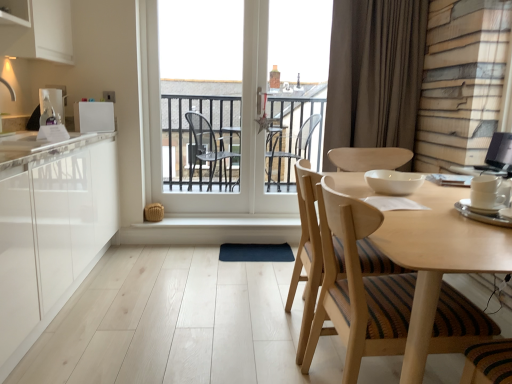
Question: Is point (337, 79) positioned closer to the camera than point (22, 170)?

Choices:
 (A) closer
 (B) farther

Answer: (B)

Question: From the image's perspective, is brown fabric curtain at upper right above or below white glossy countertop at left?

Choices:
 (A) above
 (B) below

Answer: (A)

Question: Considering the real-world distances, which object is farthest from the white ceramic cup at right, the 4th appliance positioned from the left?

Choices:
 (A) matte white soap dispenser at left, the 5th appliance from the front
 (B) white glass door at center
 (C) white glossy countertop at left
 (D) wooden chair with striped cushion at center
 (E) light wood round table at center

Answer: (A)

Question: Estimate the real-world distances between objects in this image. Which object is closer to the white glossy countertop at left?

Choices:
 (A) white glossy refrigerator at upper left, placed as the 4th appliance when sorted from right to left
 (B) white glossy bowl at center, which is the 2th appliance in front-to-back order
 (C) light wood round table at center
 (D) wooden chair with striped cushion at center
 (E) black glossy monitor at upper right, which ranks as the 3th appliance in front-to-back order

Answer: (A)